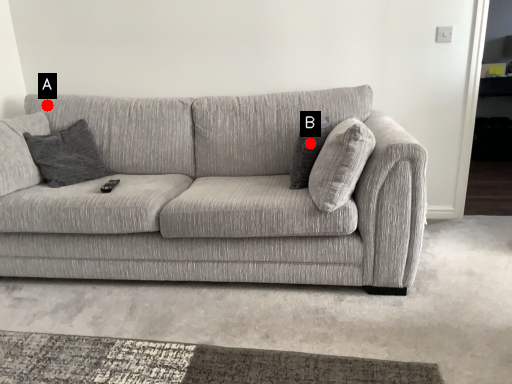
Question: Two points are circled on the image, labeled by A and B beside each circle. Which point is farther from the camera taking this photo?

Choices:
 (A) A is further
 (B) B is further

Answer: (A)